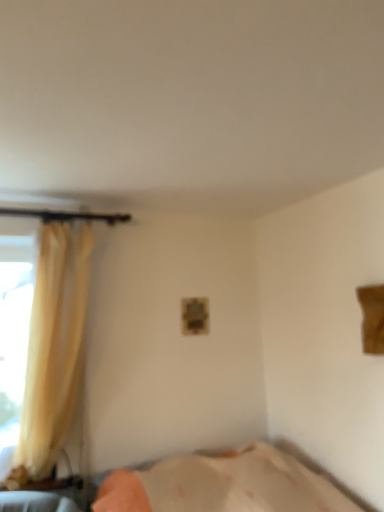
Question: Is silky yellow curtain at left completely or partially outside of beige fabric bed at lower center?

Choices:
 (A) yes
 (B) no

Answer: (A)

Question: Is silky yellow curtain at left taller than beige fabric bed at lower center?

Choices:
 (A) no
 (B) yes

Answer: (B)

Question: Can you confirm if silky yellow curtain at left is thinner than beige fabric bed at lower center?

Choices:
 (A) no
 (B) yes

Answer: (B)

Question: From a real-world perspective, does silky yellow curtain at left stand above beige fabric bed at lower center?

Choices:
 (A) no
 (B) yes

Answer: (B)

Question: Is beige fabric bed at lower center located within silky yellow curtain at left?

Choices:
 (A) no
 (B) yes

Answer: (A)

Question: Is silky yellow curtain at left at the right side of beige fabric bed at lower center?

Choices:
 (A) yes
 (B) no

Answer: (B)

Question: Is beige fabric bed at lower center looking in the opposite direction of silky yellow curtain at left?

Choices:
 (A) yes
 (B) no

Answer: (B)

Question: Can you confirm if beige fabric bed at lower center is thinner than silky yellow curtain at left?

Choices:
 (A) yes
 (B) no

Answer: (B)

Question: Does beige fabric bed at lower center have a lesser height compared to silky yellow curtain at left?

Choices:
 (A) yes
 (B) no

Answer: (A)

Question: From a real-world perspective, is beige fabric bed at lower center physically above silky yellow curtain at left?

Choices:
 (A) yes
 (B) no

Answer: (B)

Question: Does beige fabric bed at lower center appear on the left side of silky yellow curtain at left?

Choices:
 (A) yes
 (B) no

Answer: (B)

Question: Is beige fabric bed at lower center closer to camera compared to silky yellow curtain at left?

Choices:
 (A) no
 (B) yes

Answer: (B)

Question: Considering the positions of silky yellow curtain at left and beige fabric bed at lower center in the image, is silky yellow curtain at left wider or thinner than beige fabric bed at lower center?

Choices:
 (A) wide
 (B) thin

Answer: (B)